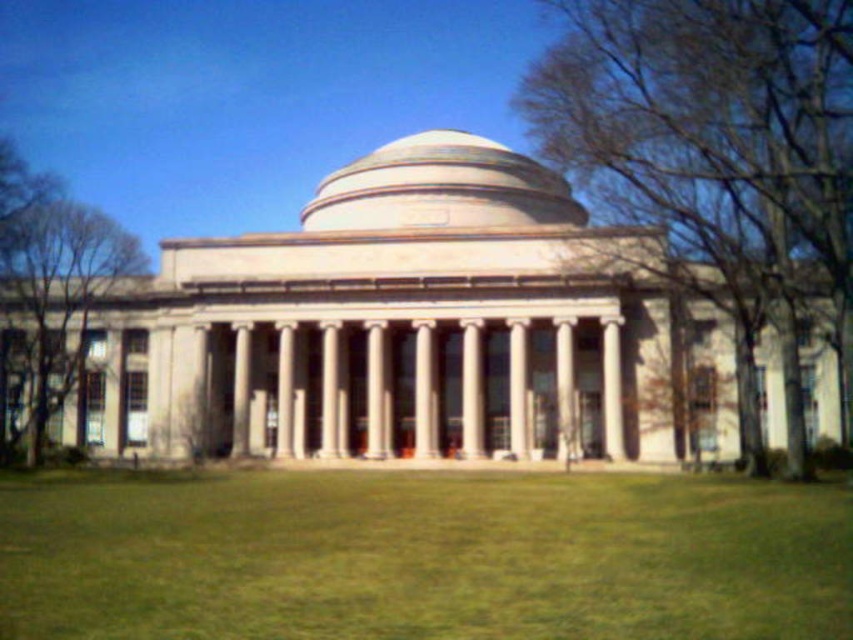
You are standing in front of the grand neoclassical building and notice the green grass at center and the white marble pillar at center. Which object is located to the right of the other?

The green grass at center is positioned on the right side of white marble pillar at center.